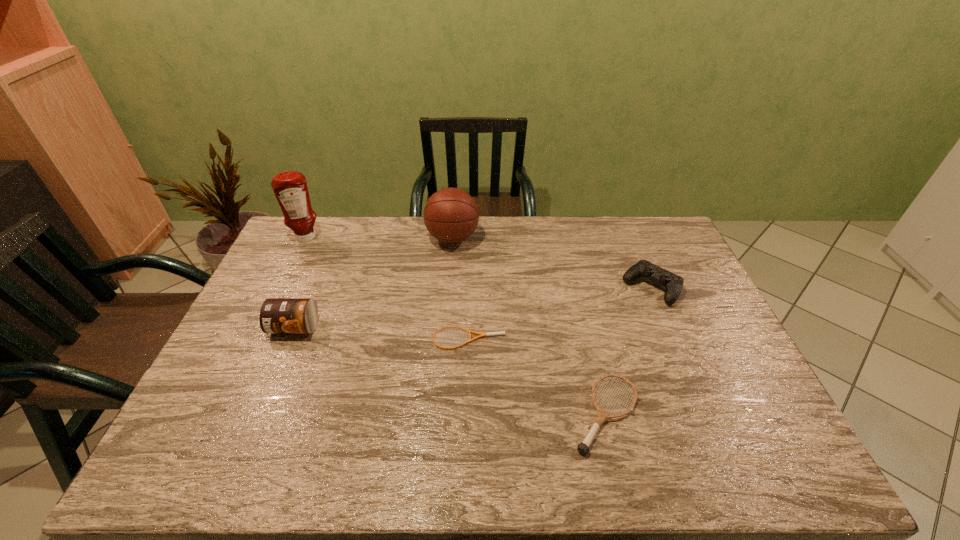
Find the location of a particular element. The height and width of the screenshot is (540, 960). free location located on the right of the basketball is located at coordinates (546, 238).

The image size is (960, 540). I want to click on free region located 0.200m on the front label of the can, so click(x=263, y=401).

Where is `vacant space located 0.290m on the back of the control`? vacant space located 0.290m on the back of the control is located at coordinates (623, 221).

I want to click on vacant space located on the right of the fifth tallest object, so click(678, 414).

Locate an element on the screen. This screenshot has width=960, height=540. vacant space situated on the back of the shortest object is located at coordinates (470, 272).

The height and width of the screenshot is (540, 960). I want to click on condiment at the far edge, so click(x=290, y=188).

Find the location of a particular element. The image size is (960, 540). basketball at the far edge is located at coordinates (451, 215).

Image resolution: width=960 pixels, height=540 pixels. I want to click on object present at the near edge, so click(583, 448).

This screenshot has width=960, height=540. Identify the location of condiment that is at the left edge. (290, 188).

The height and width of the screenshot is (540, 960). What are the coordinates of `can at the left edge` in the screenshot? It's located at (277, 315).